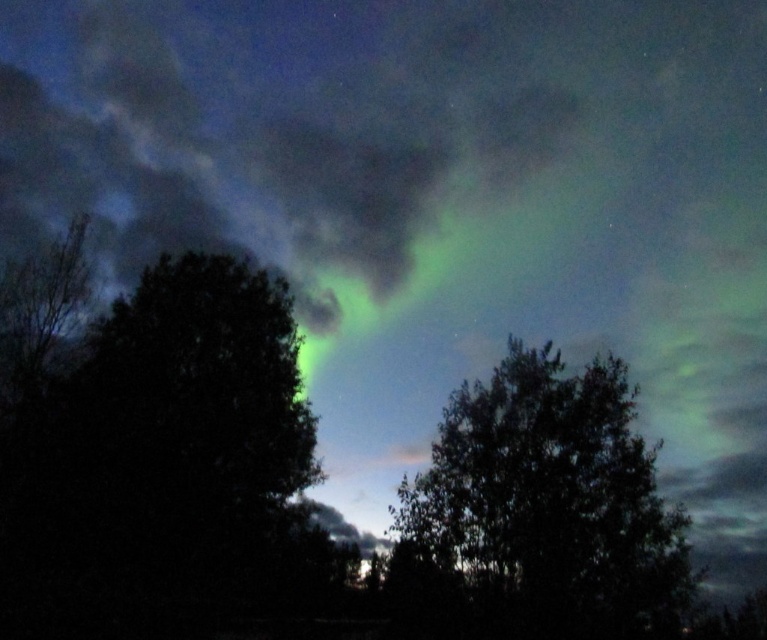
You are standing in a location where the Northern Lights are visible. There is a specific point in the sky marked at coordinates point (x=517, y=86). If you want to take a photo of this point with your camera, which has a maximum focus range of 150 feet, will your camera be able to focus on it?

The point (x=517, y=86) is 142.66 feet away from the viewer. Since the camera can focus up to 150 feet, it is within the maximum range. Therefore, the camera can focus on the point (x=517, y=86).

You are a photographer standing between two objects in the scene. The objects are the green translucent aurora at upper center and the dense dark trees in the foreground. How far apart are these two objects?

The green translucent aurora at upper center and the dense dark trees in the foreground are 41.75 meters apart.

You are standing in a forest at night under the Northern Lights. You notice a specific point in the sky at coordinates point [268,128]. What is the object located at that point?

The point [268,128] corresponds to the green translucent aurora at upper center.